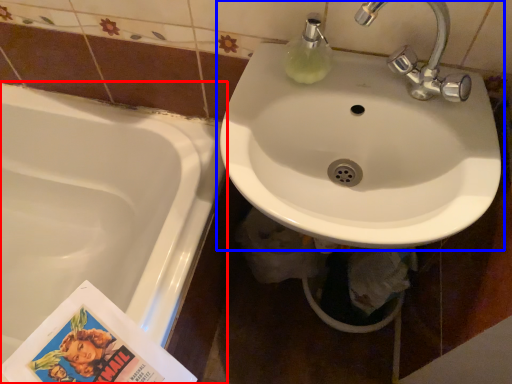
Question: Among these objects, which one is farthest to the camera, bathtub (highlighted by a red box) or sink (highlighted by a blue box)?

Choices:
 (A) bathtub
 (B) sink

Answer: (A)